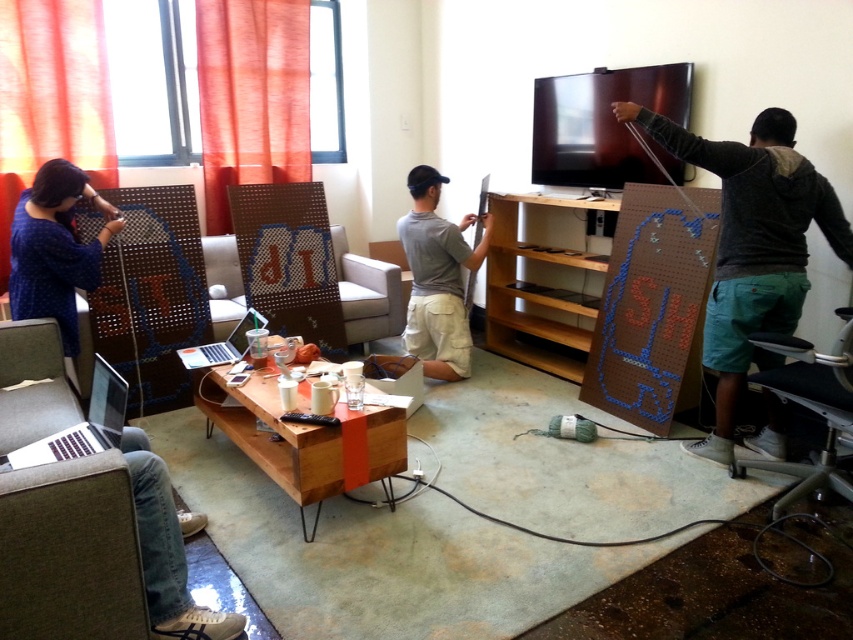
Based on the photo, you are standing in the living room and see the green cotton shorts at right and the blue fabric shirt at left. Which one is positioned lower in the image?

The green cotton shorts at right is located below the blue fabric shirt at left, so it is positioned lower in the image.

You are trying to decide which clothing item to take with you on a trip. You have the green cotton shorts at right and the blue fabric shirt at left. Which one takes up more space in your bag?

The green cotton shorts at right is bigger than the blue fabric shirt at left, so it takes up more space in your bag.

You are organizing a clothing donation drive and need to categorize the blue fabric shirt at left and the gray matte shirt at center based on their sizes. Which shirt should be placed in the small section?

The blue fabric shirt at left should be placed in the small section because it has a smaller size compared to the gray matte shirt at center.